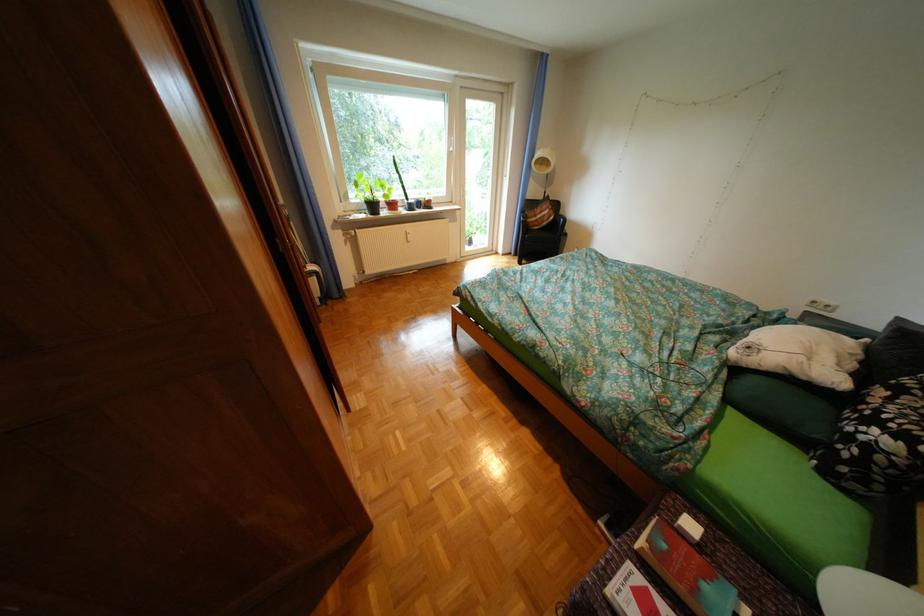
The width and height of the screenshot is (924, 616). Identify the location of radiator valve knob. (315, 282).